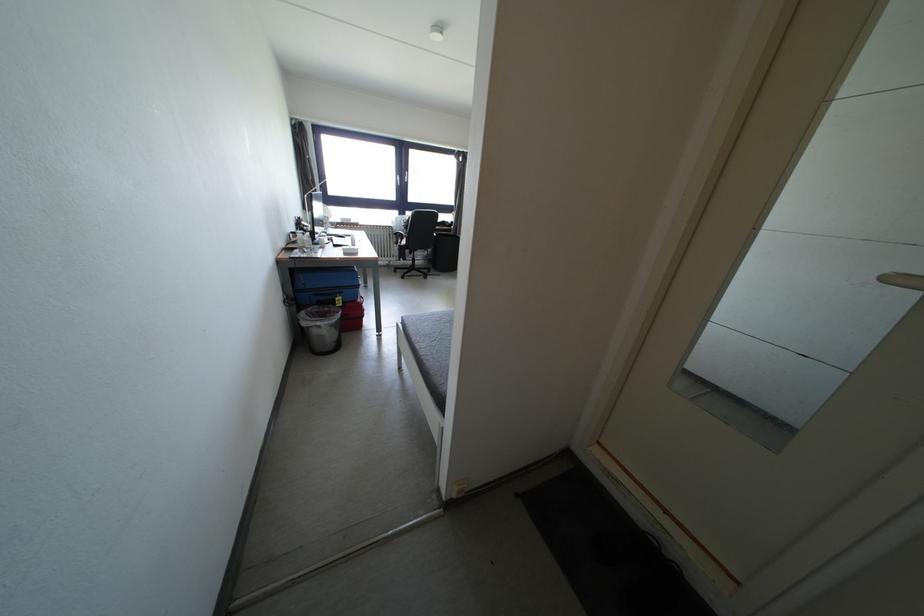
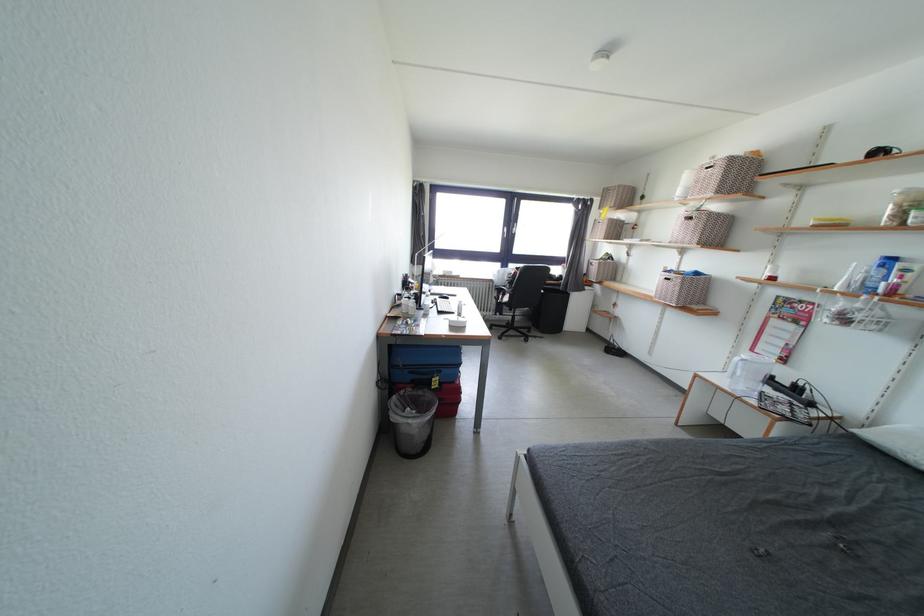
Question: The camera is either moving clockwise (left) or counter-clockwise (right) around the object. The first image is from the beginning of the video and the second image is from the end. Is the camera moving left or right when shooting the video?

Choices:
 (A) Left
 (B) Right

Answer: (B)